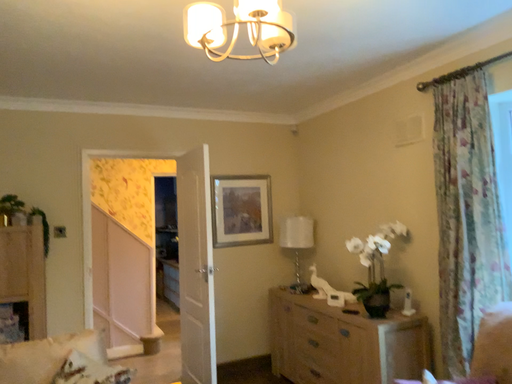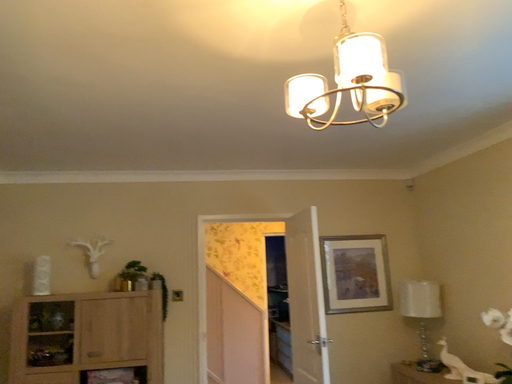
Question: How did the camera likely rotate when shooting the video?

Choices:
 (A) rotated upward
 (B) rotated downward

Answer: (A)